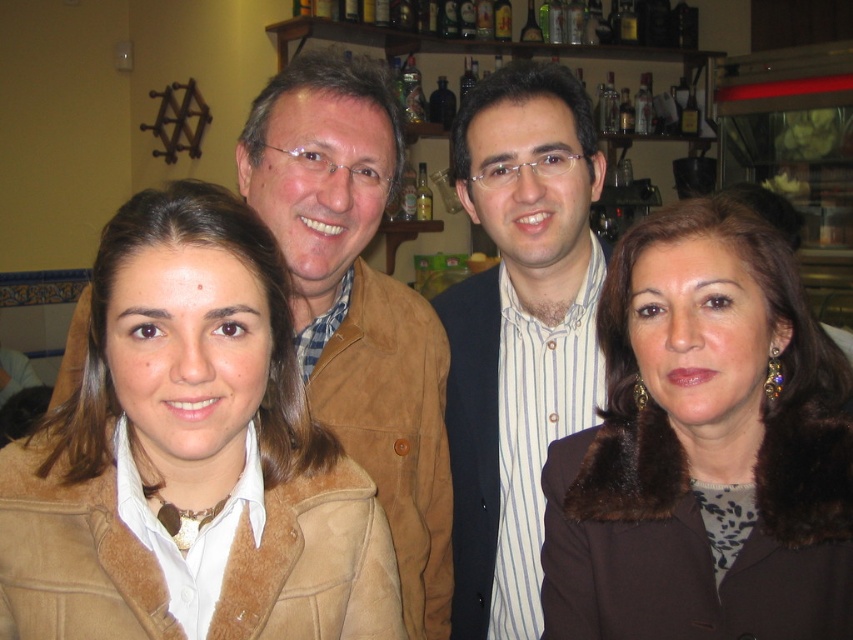
Is brown fur coat at right taller than white striped shirt at center?

No.

Can you confirm if brown fur coat at right is shorter than white striped shirt at center?

Indeed, brown fur coat at right has a lesser height compared to white striped shirt at center.

Find the location of `brown fur coat at right`. brown fur coat at right is located at coordinates (705, 449).

The width and height of the screenshot is (853, 640). I want to click on brown fur coat at right, so click(x=705, y=449).

Does suede jacket at left appear on the left side of brown fur coat at right?

Correct, you'll find suede jacket at left to the left of brown fur coat at right.

What do you see at coordinates (190, 456) in the screenshot? The height and width of the screenshot is (640, 853). I see `suede jacket at left` at bounding box center [190, 456].

I want to click on suede jacket at left, so click(x=190, y=456).

Is point (799, 390) positioned after point (289, 120)?

No, it is in front of (289, 120).

The height and width of the screenshot is (640, 853). In order to click on brown fur coat at right in this screenshot , I will do `click(705, 449)`.